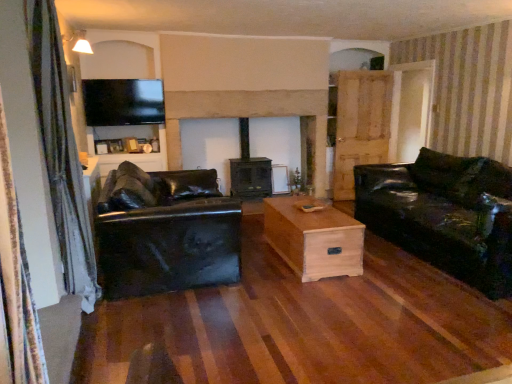
Identify the location of black leather couch at left, acting as the first studio couch starting from the left. (165, 232).

This screenshot has width=512, height=384. What do you see at coordinates (314, 238) in the screenshot?
I see `light wood/texture coffee table at center` at bounding box center [314, 238].

Locate an element on the screen. light wood/texture coffee table at center is located at coordinates (314, 238).

The height and width of the screenshot is (384, 512). What do you see at coordinates (248, 117) in the screenshot?
I see `smooth stone fireplace at center` at bounding box center [248, 117].

The width and height of the screenshot is (512, 384). Describe the element at coordinates (61, 152) in the screenshot. I see `silky blue curtain at left` at that location.

Find the location of `matte black tv at upper left`. matte black tv at upper left is located at coordinates (125, 121).

Visually, is black leather couch at left, marked as the 2th studio couch in a right-to-left arrangement, positioned to the left or to the right of transparent glass door at right?

Based on their positions, black leather couch at left, marked as the 2th studio couch in a right-to-left arrangement, is located to the left of transparent glass door at right.

Starting from the transparent glass door at right, which studio couch is the 2nd one to the left? Please provide its 2D coordinates.

[(165, 232)]

Could transparent glass door at right be considered to be inside black leather couch at left, acting as the first studio couch starting from the left?

Definitely not — transparent glass door at right is not inside black leather couch at left, acting as the first studio couch starting from the left.

Is matte black tv at upper left directly adjacent to transparent glass door at right?

No, matte black tv at upper left is not beside transparent glass door at right.

Can you confirm if matte black tv at upper left is wider than transparent glass door at right?

No.

Is matte black tv at upper left oriented towards transparent glass door at right?

No, matte black tv at upper left is not oriented towards transparent glass door at right.

Locate an element on the screen. glass door below the matte black tv at upper left (from the image's perspective) is located at coordinates pyautogui.click(x=411, y=109).

Which of these two, matte black tv at upper left or glossy black leather couch at right, the 2th studio couch positioned from the left, stands shorter?

glossy black leather couch at right, the 2th studio couch positioned from the left, is shorter.

Does matte black tv at upper left appear on the right side of glossy black leather couch at right, which is counted as the first studio couch, starting from the right?

In fact, matte black tv at upper left is to the left of glossy black leather couch at right, which is counted as the first studio couch, starting from the right.

Is glossy black leather couch at right, the 2th studio couch positioned from the left, a part of matte black tv at upper left?

Actually, glossy black leather couch at right, the 2th studio couch positioned from the left, is outside matte black tv at upper left.

From a real-world perspective, is light wood/texture coffee table at center positioned over transparent glass door at right based on gravity?

Actually, light wood/texture coffee table at center is physically below transparent glass door at right in the real world.

How different are the orientations of light wood/texture coffee table at center and transparent glass door at right in degrees?

0.594 degrees.

Which of these two, light wood/texture coffee table at center or transparent glass door at right, stands shorter?

light wood/texture coffee table at center.

Between point (313, 225) and point (410, 143), which one is positioned behind?

The point (410, 143) is more distant.

Between matte black tv at upper left and smooth stone fireplace at center, which one is positioned in front?

matte black tv at upper left is in front.

From the image's perspective, is matte black tv at upper left on top of smooth stone fireplace at center?

Yes.

Considering the relative sizes of matte black tv at upper left and smooth stone fireplace at center in the image provided, is matte black tv at upper left shorter than smooth stone fireplace at center?

Correct, matte black tv at upper left is not as tall as smooth stone fireplace at center.

Between matte black tv at upper left and light wood/texture coffee table at center, which one has more height?

matte black tv at upper left.

From a real-world perspective, is matte black tv at upper left over light wood/texture coffee table at center?

Yes, from a real-world perspective, matte black tv at upper left is on top of light wood/texture coffee table at center.

Which is less distant, [161,118] or [338,215]?

Point [161,118] is farther from the camera than point [338,215].

Is matte black tv at upper left oriented away from light wood/texture coffee table at center?

No, matte black tv at upper left's orientation is not away from light wood/texture coffee table at center.

Consider the image. Is matte black tv at upper left inside the boundaries of smooth stone fireplace at center, or outside?

matte black tv at upper left cannot be found inside smooth stone fireplace at center.

Which is in front, point (143, 96) or point (236, 109)?

Point (143, 96)

Considering the relative positions of matte black tv at upper left and smooth stone fireplace at center in the image provided, is matte black tv at upper left to the left or to the right of smooth stone fireplace at center?

matte black tv at upper left is positioned on smooth stone fireplace at center's left side.

Considering the sizes of objects matte black tv at upper left and smooth stone fireplace at center in the image provided, who is shorter, matte black tv at upper left or smooth stone fireplace at center?

matte black tv at upper left is shorter.

Where is `glass door on the right of the black leather couch at left, acting as the first studio couch starting from the left`? The width and height of the screenshot is (512, 384). glass door on the right of the black leather couch at left, acting as the first studio couch starting from the left is located at coordinates (411, 109).

Image resolution: width=512 pixels, height=384 pixels. In the image, there is a matte black tv at upper left. In order to click on glass door below it (from a real-world perspective) in this screenshot , I will do `click(411, 109)`.

From the picture: From the image, which object appears to be nearer to matte black tv at upper left, glossy black leather couch at right, the 2th studio couch positioned from the left, or black leather couch at left, acting as the first studio couch starting from the left?

The object closer to matte black tv at upper left is black leather couch at left, acting as the first studio couch starting from the left.

Estimate the real-world distances between objects in this image. Which object is further from silky blue curtain at left, transparent glass door at right or black leather couch at left, marked as the 2th studio couch in a right-to-left arrangement?

The object further to silky blue curtain at left is transparent glass door at right.

When comparing their distances from transparent glass door at right, does glossy black leather couch at right, the 2th studio couch positioned from the left, or black leather couch at left, marked as the 2th studio couch in a right-to-left arrangement, seem closer?

glossy black leather couch at right, the 2th studio couch positioned from the left, is positioned closer to the anchor transparent glass door at right.

Which object lies nearer to the anchor point silky blue curtain at left, glossy black leather couch at right, which is counted as the first studio couch, starting from the right, or black leather couch at left, marked as the 2th studio couch in a right-to-left arrangement?

black leather couch at left, marked as the 2th studio couch in a right-to-left arrangement, lies closer to silky blue curtain at left than the other object.

In the scene shown: Considering their positions, is glossy black leather couch at right, the 2th studio couch positioned from the left, positioned further to light wood/texture coffee table at center than transparent glass door at right?

transparent glass door at right is positioned further to the anchor light wood/texture coffee table at center.

Looking at this image, which object lies nearer to the anchor point silky blue curtain at left, light wood/texture coffee table at center or transparent glass door at right?

The object closer to silky blue curtain at left is light wood/texture coffee table at center.

Looking at the image, which one is located further to glossy black leather couch at right, the 2th studio couch positioned from the left, smooth stone fireplace at center or matte black tv at upper left?

matte black tv at upper left lies further to glossy black leather couch at right, the 2th studio couch positioned from the left, than the other object.

Which object lies nearer to the anchor point matte black tv at upper left, black leather couch at left, marked as the 2th studio couch in a right-to-left arrangement, or light wood/texture coffee table at center?

black leather couch at left, marked as the 2th studio couch in a right-to-left arrangement, is positioned closer to the anchor matte black tv at upper left.

Identify the location of entertainment center between silky blue curtain at left and smooth stone fireplace at center in the front-back direction. (125, 121).

Where is `studio couch situated between silky blue curtain at left and light wood/texture coffee table at center from left to right`? The height and width of the screenshot is (384, 512). studio couch situated between silky blue curtain at left and light wood/texture coffee table at center from left to right is located at coordinates (165, 232).

I want to click on studio couch between black leather couch at left, marked as the 2th studio couch in a right-to-left arrangement, and transparent glass door at right from left to right, so click(x=444, y=214).

This screenshot has height=384, width=512. I want to click on entertainment center positioned between black leather couch at left, acting as the first studio couch starting from the left, and matte black tv at upper left from near to far, so click(125, 121).